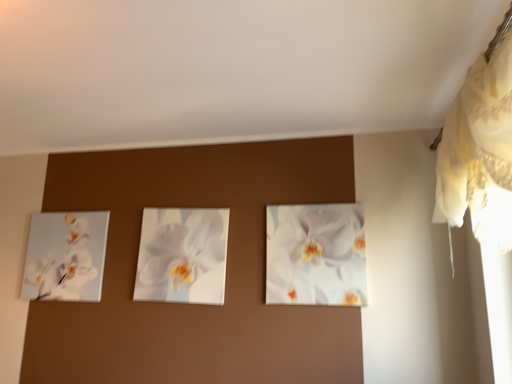
This screenshot has width=512, height=384. I want to click on white glossy orchid painting at left, so click(x=66, y=256).

Find the location of a particular element. flower on the left of white glossy orchid at center, which is counted as the first flower, starting from the right is located at coordinates tap(180, 251).

Based on the photo, is white glossy orchid at center, which appears as the first flower when viewed from the left, looking in the opposite direction of white glossy orchid at center, which appears as the 2th flower when viewed from the left?

That's not correct — white glossy orchid at center, which appears as the first flower when viewed from the left, is not looking away from white glossy orchid at center, which appears as the 2th flower when viewed from the left.

From a real-world perspective, which is physically below, white glossy orchid at center, which appears as the first flower when viewed from the left, or white glossy orchid at center, which is counted as the first flower, starting from the right?

white glossy orchid at center, which appears as the first flower when viewed from the left, is physically lower.

Between point (158, 292) and point (271, 272), which one is positioned in front?

Point (271, 272)

Which object is closer to the camera taking this photo, white glossy orchid at center, which appears as the 2th flower when viewed from the left, or white glossy orchid at center, marked as the 2th flower in a right-to-left arrangement?

Positioned in front is white glossy orchid at center, which appears as the 2th flower when viewed from the left.

Is white glossy orchid at center, which is counted as the first flower, starting from the right, looking in the opposite direction of white glossy orchid at center, which appears as the first flower when viewed from the left?

No, white glossy orchid at center, which is counted as the first flower, starting from the right, is not facing away from white glossy orchid at center, which appears as the first flower when viewed from the left.

Can you confirm if white glossy orchid painting at left is positioned to the right of white glossy orchid at center, which is counted as the first flower, starting from the right?

No.

Looking at this image, does white glossy orchid painting at left turn towards white glossy orchid at center, which appears as the 2th flower when viewed from the left?

No, white glossy orchid painting at left is not turned towards white glossy orchid at center, which appears as the 2th flower when viewed from the left.

Does white glossy orchid at center, which appears as the first flower when viewed from the left, have a lesser height compared to white lace curtain at upper right?

Yes.

Identify the location of curtain located in front of the white glossy orchid at center, marked as the 2th flower in a right-to-left arrangement. pos(477,138).

Is the position of white glossy orchid at center, which appears as the first flower when viewed from the left, more distant than that of white lace curtain at upper right?

Yes, white glossy orchid at center, which appears as the first flower when viewed from the left, is further from the camera.

Where is `the 1st flower below the white lace curtain at upper right (from a real-world perspective)`? Image resolution: width=512 pixels, height=384 pixels. the 1st flower below the white lace curtain at upper right (from a real-world perspective) is located at coordinates pos(316,255).

Does white glossy orchid at center, which is counted as the first flower, starting from the right, turn towards white lace curtain at upper right?

No, white glossy orchid at center, which is counted as the first flower, starting from the right, is not aimed at white lace curtain at upper right.

Is white glossy orchid at center, which appears as the 2th flower when viewed from the left, inside or outside of white lace curtain at upper right?

white glossy orchid at center, which appears as the 2th flower when viewed from the left, lies outside white lace curtain at upper right.

Can you confirm if white glossy orchid at center, which is counted as the first flower, starting from the right, is smaller than white lace curtain at upper right?

Correct, white glossy orchid at center, which is counted as the first flower, starting from the right, occupies less space than white lace curtain at upper right.

In the scene shown: From the image's perspective, which is below, white glossy orchid at center, which is counted as the first flower, starting from the right, or white glossy orchid painting at left?

white glossy orchid painting at left appears lower in the image.

This screenshot has height=384, width=512. Find the location of `the 2nd flower above the white glossy orchid painting at left (from a real-world perspective)`. the 2nd flower above the white glossy orchid painting at left (from a real-world perspective) is located at coordinates (316, 255).

Considering the sizes of objects white glossy orchid at center, which is counted as the first flower, starting from the right, and white glossy orchid painting at left in the image provided, who is shorter, white glossy orchid at center, which is counted as the first flower, starting from the right, or white glossy orchid painting at left?

With less height is white glossy orchid painting at left.

Considering the sizes of white glossy orchid at center, which appears as the 2th flower when viewed from the left, and white glossy orchid painting at left in the image, is white glossy orchid at center, which appears as the 2th flower when viewed from the left, bigger or smaller than white glossy orchid painting at left?

Considering their sizes, white glossy orchid at center, which appears as the 2th flower when viewed from the left, takes up more space than white glossy orchid painting at left.

Considering the relative sizes of white lace curtain at upper right and white glossy orchid painting at left in the image provided, is white lace curtain at upper right taller than white glossy orchid painting at left?

Yes, white lace curtain at upper right is taller than white glossy orchid painting at left.

From a real-world perspective, who is located lower, white lace curtain at upper right or white glossy orchid painting at left?

white glossy orchid painting at left is physically lower.

From the image's perspective, between white lace curtain at upper right and white glossy orchid painting at left, which one is located above?

white lace curtain at upper right, from the image's perspective.

Locate an element on the screen. This screenshot has width=512, height=384. flower below the white glossy orchid at center, which appears as the 2th flower when viewed from the left (from the image's perspective) is located at coordinates pyautogui.click(x=180, y=251).

Where is `flower below the white glossy orchid at center, which is counted as the first flower, starting from the right (from a real-world perspective)`? flower below the white glossy orchid at center, which is counted as the first flower, starting from the right (from a real-world perspective) is located at coordinates (180, 251).

Based on their spatial positions, is white glossy orchid at center, which appears as the 2th flower when viewed from the left, or white glossy orchid at center, which appears as the first flower when viewed from the left, further from white lace curtain at upper right?

Among the two, white glossy orchid at center, which appears as the first flower when viewed from the left, is located further to white lace curtain at upper right.

Estimate the real-world distances between objects in this image. Which object is closer to white glossy orchid at center, which appears as the first flower when viewed from the left, white lace curtain at upper right or white glossy orchid at center, which appears as the 2th flower when viewed from the left?

white glossy orchid at center, which appears as the 2th flower when viewed from the left, is closer to white glossy orchid at center, which appears as the first flower when viewed from the left.

Based on their spatial positions, is white glossy orchid at center, which appears as the 2th flower when viewed from the left, or white glossy orchid at center, which appears as the first flower when viewed from the left, further from white glossy orchid painting at left?

Based on the image, white glossy orchid at center, which appears as the 2th flower when viewed from the left, appears to be further to white glossy orchid painting at left.

From the image, which object appears to be farther from white lace curtain at upper right, white glossy orchid painting at left or white glossy orchid at center, which appears as the first flower when viewed from the left?

white glossy orchid painting at left.

In the scene shown: Based on their spatial positions, is white glossy orchid at center, which is counted as the first flower, starting from the right, or white glossy orchid painting at left closer to white glossy orchid at center, marked as the 2th flower in a right-to-left arrangement?

white glossy orchid painting at left is closer to white glossy orchid at center, marked as the 2th flower in a right-to-left arrangement.

From the image, which object appears to be farther from white glossy orchid at center, which is counted as the first flower, starting from the right, white lace curtain at upper right or white glossy orchid painting at left?

white glossy orchid painting at left.

Consider the image. Estimate the real-world distances between objects in this image. Which object is further from white glossy orchid at center, which is counted as the first flower, starting from the right, white glossy orchid at center, marked as the 2th flower in a right-to-left arrangement, or white glossy orchid painting at left?

The object further to white glossy orchid at center, which is counted as the first flower, starting from the right, is white glossy orchid painting at left.

From the image, which object appears to be nearer to white lace curtain at upper right, white glossy orchid at center, which appears as the first flower when viewed from the left, or white glossy orchid painting at left?

Among the two, white glossy orchid at center, which appears as the first flower when viewed from the left, is located nearer to white lace curtain at upper right.

The height and width of the screenshot is (384, 512). What are the coordinates of `flower between white lace curtain at upper right and white glossy orchid at center, marked as the 2th flower in a right-to-left arrangement, in the front-back direction` in the screenshot? It's located at tap(316, 255).

Locate an element on the screen. Image resolution: width=512 pixels, height=384 pixels. flower between white glossy orchid painting at left and white glossy orchid at center, which appears as the 2th flower when viewed from the left, from left to right is located at coordinates (180, 251).